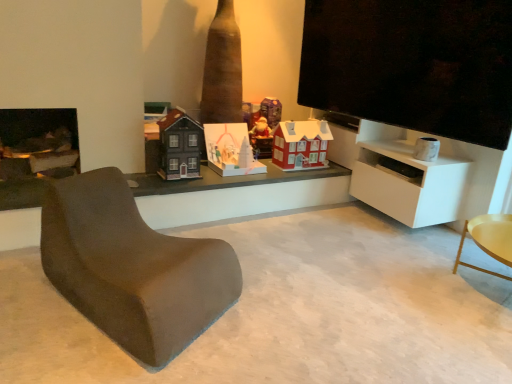
At what (x,y) coordinates should I click in order to perform the action: click on vacant area that lies between white matte cabinet at right and matte brown chair at lower left. Please return your answer as a coordinate pair (x, y). Looking at the image, I should click on (313, 251).